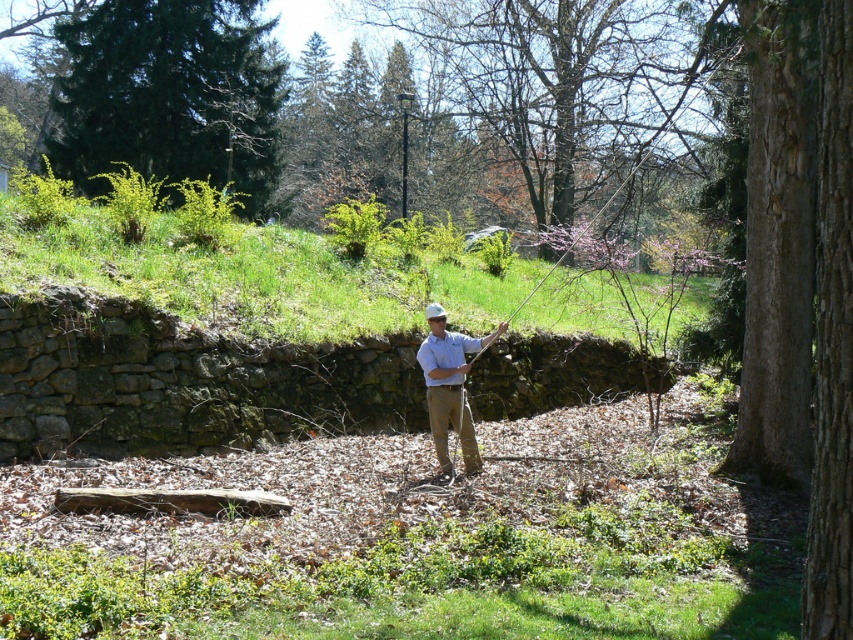
Is bare branches at upper center positioned at the back of green textured evergreen tree at upper left?

That is False.

Is bare branches at upper center wider than green textured evergreen tree at upper left?

Correct, the width of bare branches at upper center exceeds that of green textured evergreen tree at upper left.

Which is in front, point (683, 54) or point (61, 77)?

Point (61, 77) is in front.

Locate an element on the screen. This screenshot has width=853, height=640. bare branches at upper center is located at coordinates (564, 81).

Can you confirm if green textured evergreen tree at upper left is shorter than light blue shirt at center?

No.

Can you confirm if green textured evergreen tree at upper left is positioned to the right of light blue shirt at center?

No, green textured evergreen tree at upper left is not to the right of light blue shirt at center.

Which is in front, point (76, 116) or point (424, 362)?

Point (424, 362) is more forward.

At what (x,y) coordinates should I click in order to perform the action: click on green textured evergreen tree at upper left. Please return your answer as a coordinate pair (x, y). This screenshot has width=853, height=640. Looking at the image, I should click on (170, 93).

Is point (645, 144) positioned behind point (444, 349)?

Yes.

Does point (579, 65) come closer to viewer compared to point (444, 362)?

No, it is behind (444, 362).

At what (x,y) coordinates should I click in order to perform the action: click on bare branches at upper center. Please return your answer as a coordinate pair (x, y). The width and height of the screenshot is (853, 640). Looking at the image, I should click on (564, 81).